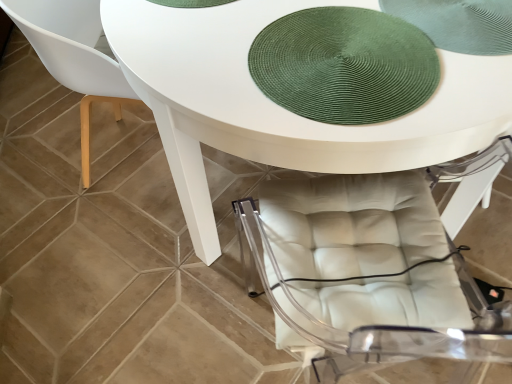
What is the approximate height of matte white chair at lower left?

It is 32.06 inches.

Where is `white glossy table at center`? The height and width of the screenshot is (384, 512). white glossy table at center is located at coordinates (279, 106).

Who is bigger, white glossy table at center or matte white chair at lower left?

white glossy table at center is bigger.

Which object is further away from the camera taking this photo, white glossy table at center or matte white chair at lower left?

matte white chair at lower left is behind.

Choose the correct answer: Is white glossy table at center inside matte white chair at lower left or outside it?

white glossy table at center lies outside matte white chair at lower left.

Is point (187, 52) positioned behind point (308, 117)?

Yes, point (187, 52) is behind point (308, 117).

In the image, there is a white glossy table at center. Where is `mat below it (from the image's perspective)`? Image resolution: width=512 pixels, height=384 pixels. mat below it (from the image's perspective) is located at coordinates (344, 65).

Is green woven mat at upper center located within white glossy table at center?

Indeed, green woven mat at upper center is located within white glossy table at center.

Based on the photo, is white glossy table at center turned away from green woven mat at upper center?

No, green woven mat at upper center is not at the back of white glossy table at center.

From the image's perspective, is green woven mat at upper center positioned above or below matte white chair at lower left?

Clearly, from the image's perspective, green woven mat at upper center is below matte white chair at lower left.

Between green woven mat at upper center and matte white chair at lower left, which one is positioned in front?

green woven mat at upper center is in front.

Is green woven mat at upper center turned away from matte white chair at lower left?

That's not correct — green woven mat at upper center is not looking away from matte white chair at lower left.

Is green woven mat at upper center situated inside matte white chair at lower left or outside?

green woven mat at upper center is spatially situated outside matte white chair at lower left.

Is green woven mat at upper center positioned before white glossy table at center?

No, green woven mat at upper center is further to the viewer.

From the image's perspective, between green woven mat at upper center and white glossy table at center, who is located below?

From the image's view, green woven mat at upper center is below.

Is green woven mat at upper center facing towards white glossy table at center?

Yes, green woven mat at upper center is facing white glossy table at center.

From a real-world perspective, which object stands above the other?

From a 3D spatial view, green woven mat at upper center is above.

From the image's perspective, which object appears higher, matte white chair at lower left or green woven mat at upper center?

matte white chair at lower left is shown above in the image.

Considering the relative sizes of matte white chair at lower left and green woven mat at upper center in the image provided, is matte white chair at lower left shorter than green woven mat at upper center?

Incorrect, the height of matte white chair at lower left does not fall short of that of green woven mat at upper center.

Which of these two, matte white chair at lower left or green woven mat at upper center, is wider?

Wider between the two is matte white chair at lower left.

Considering the relative sizes of matte white chair at lower left and white glossy table at center in the image provided, is matte white chair at lower left taller than white glossy table at center?

Yes, matte white chair at lower left is taller than white glossy table at center.

Does matte white chair at lower left lie behind white glossy table at center?

Yes, matte white chair at lower left is behind white glossy table at center.

Could you tell me if matte white chair at lower left is facing white glossy table at center?

Yes, matte white chair at lower left is facing white glossy table at center.

Identify the location of chair above the white glossy table at center (from a real-world perspective). The image size is (512, 384). (74, 55).

Locate an element on the screen. The height and width of the screenshot is (384, 512). table above the green woven mat at upper center (from the image's perspective) is located at coordinates click(x=279, y=106).

Estimate the real-world distances between objects in this image. Which object is closer to matte white chair at lower left, green woven mat at upper center or white glossy table at center?

Among the two, white glossy table at center is located nearer to matte white chair at lower left.

Estimate the real-world distances between objects in this image. Which object is closer to white glossy table at center, green woven mat at upper center or matte white chair at lower left?

Among the two, green woven mat at upper center is located nearer to white glossy table at center.

Based on their spatial positions, is white glossy table at center or matte white chair at lower left further from green woven mat at upper center?

The object further to green woven mat at upper center is matte white chair at lower left.

Looking at the image, which one is located further to green woven mat at upper center, matte white chair at lower left or white glossy table at center?

Based on the image, matte white chair at lower left appears to be further to green woven mat at upper center.

Estimate the real-world distances between objects in this image. Which object is further from white glossy table at center, matte white chair at lower left or green woven mat at upper center?

Among the two, matte white chair at lower left is located further to white glossy table at center.

When comparing their distances from matte white chair at lower left, does white glossy table at center or green woven mat at upper center seem further?

green woven mat at upper center is positioned further to the anchor matte white chair at lower left.

In order to click on mat between matte white chair at lower left and white glossy table at center in the horizontal direction in this screenshot , I will do `click(344, 65)`.